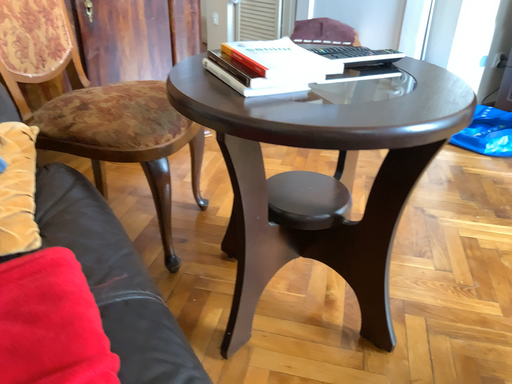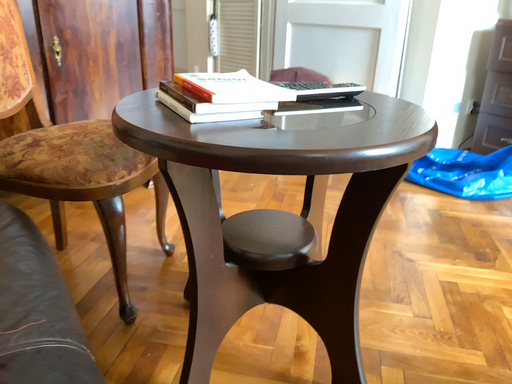
Question: How did the camera likely rotate when shooting the video?

Choices:
 (A) rotated downward
 (B) rotated upward

Answer: (B)